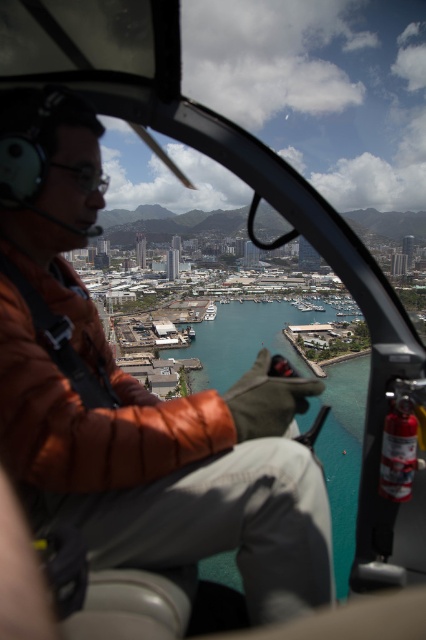
You are a passenger in the helicopter and want to know which object is higher in the scene. Which one is taller between the brown leather jacket at center and the teal glossy water at center?

The brown leather jacket at center is taller than the teal glossy water at center.